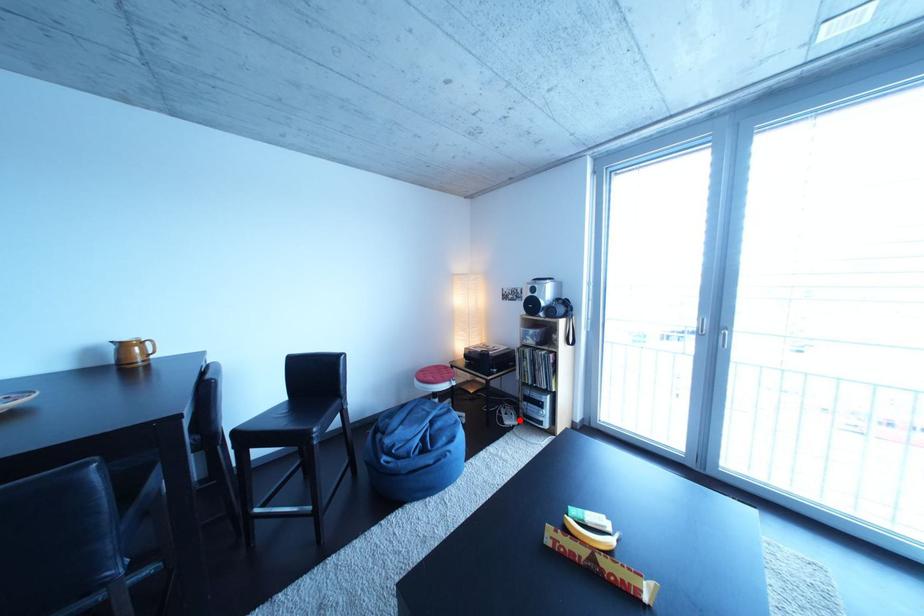
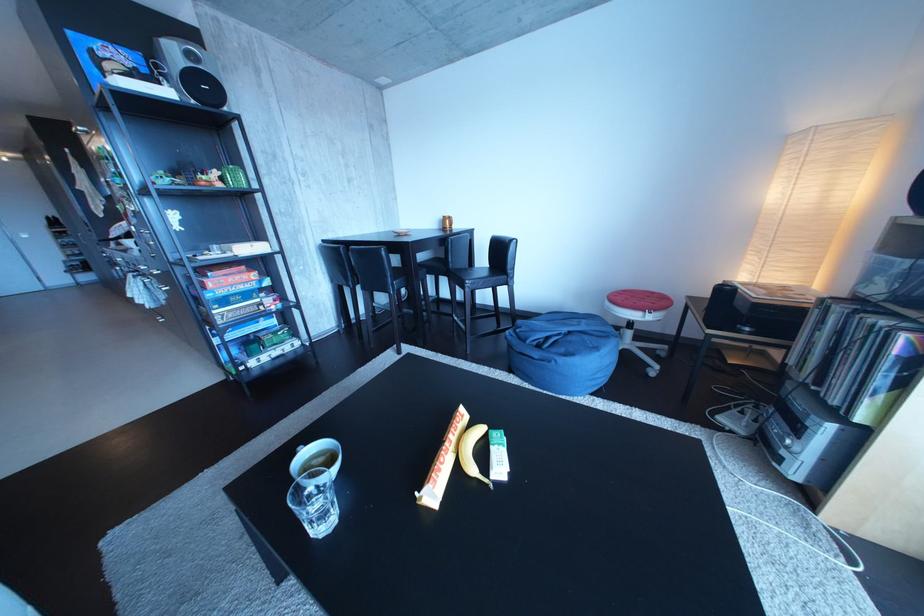
Question: A red point is marked in image1. In image2, is the corresponding 3D point closer to the camera or farther? Reply with the corresponding letter.

Choices:
 (A) The corresponding 3D point is closer.
 (B) The corresponding 3D point is farther.

Answer: (A)